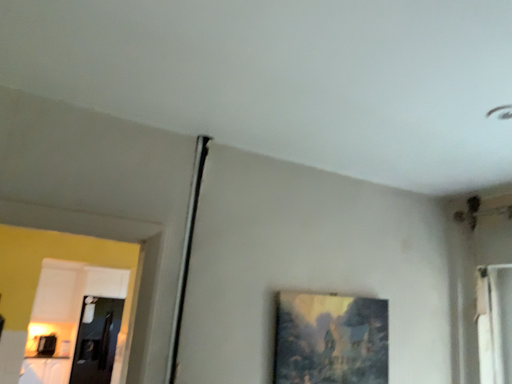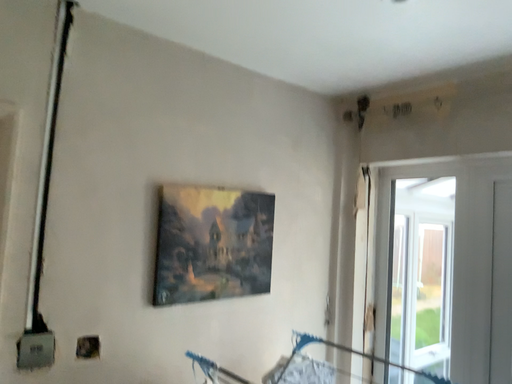
Question: How did the camera likely rotate when shooting the video?

Choices:
 (A) rotated upward
 (B) rotated downward

Answer: (B)